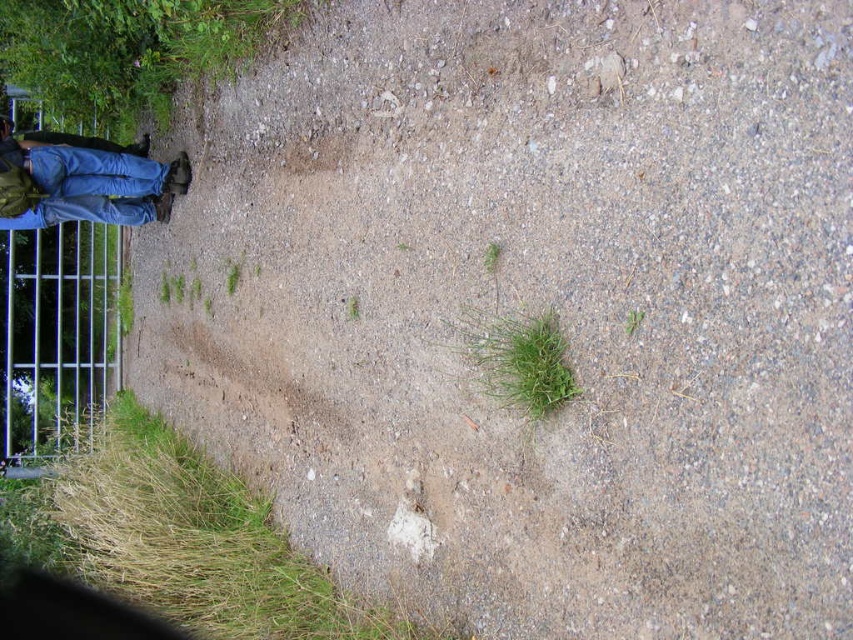
You are a hiker standing at the center of the gravel path. You want to walk to the metal gate on the far left. There is a metallic silver fence at left located at point (54, 332). Is the path between you and the metallic silver fence at left clear of large stones?

The path between you and the metallic silver fence at left is clear of large stones because the Objects Description states that at point (54, 332) lies metallic silver fence at left, implying no large stones obstruct the path.

You are a hiker navigating a gravel path and want to place a marker at two specific points. The first point is at coordinates point (x=201, y=577) and the second is at point (x=540, y=413). Which point is closer to you as you stand on the path?

Point (x=201, y=577) is closer to you because it is further to the viewer than point (x=540, y=413), meaning it is nearer in your line of sight.

In the scene shown: You are a hiker trying to navigate the gravel path. You see the blue jeans at left and the green leafy grass at center. Which object is closer to the metal gate on the far left?

The blue jeans at left is positioned on the left side of green leafy grass at center, so the blue jeans at left is closer to the metal gate on the far left.